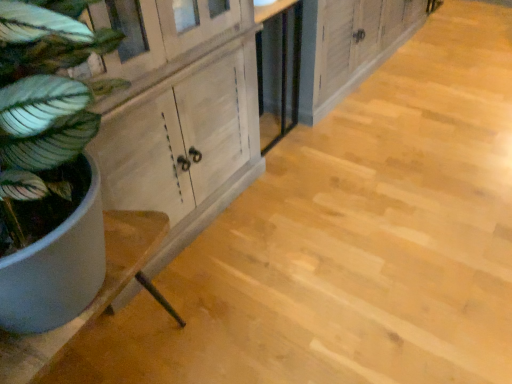
Question: Is white wood counter at left wider or thinner than wooden cabinet at center?

Choices:
 (A) thin
 (B) wide

Answer: (A)

Question: From the image's perspective, is white wood counter at left positioned above or below wooden cabinet at center?

Choices:
 (A) above
 (B) below

Answer: (B)

Question: Estimate the real-world distances between objects in this image. Which object is closer to the green matte plant at left?

Choices:
 (A) white wood counter at left
 (B) wooden cabinet at center

Answer: (A)

Question: Based on their relative distances, which object is nearer to the green matte plant at left?

Choices:
 (A) wooden cabinet at center
 (B) white wood counter at left

Answer: (B)